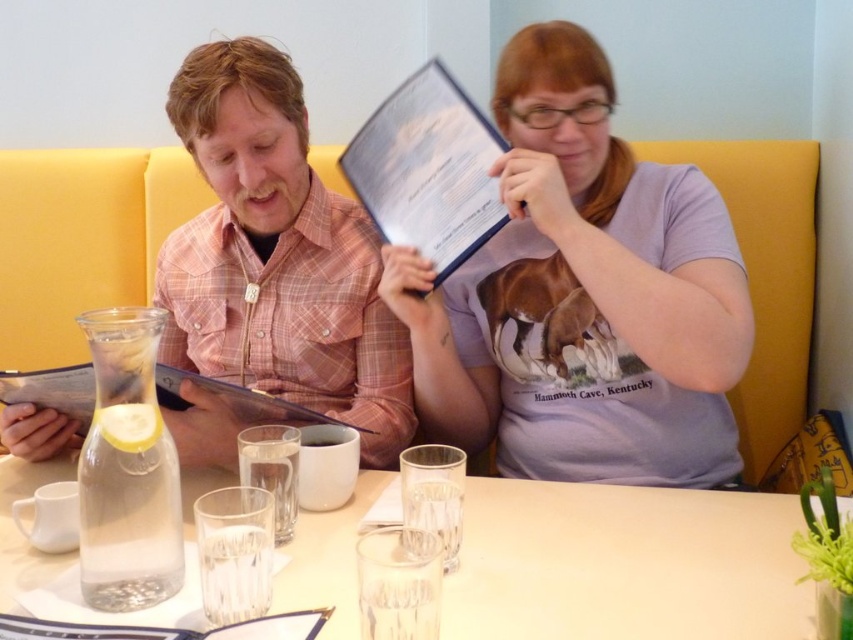
Does clear glass water at center have a greater width compared to white paper menu at upper center?

Indeed, clear glass water at center has a greater width compared to white paper menu at upper center.

Does clear glass water at center come in front of white paper menu at upper center?

That is True.

Identify the location of clear glass water at center. Image resolution: width=853 pixels, height=640 pixels. (625, 563).

Which is above, purple cotton shirt at upper right or white paper menu at upper center?

Positioned higher is white paper menu at upper center.

Is purple cotton shirt at upper right in front of white paper menu at upper center?

Yes, purple cotton shirt at upper right is in front of white paper menu at upper center.

Where is `purple cotton shirt at upper right`? purple cotton shirt at upper right is located at coordinates (583, 296).

Where is `purple cotton shirt at upper right`? This screenshot has height=640, width=853. purple cotton shirt at upper right is located at coordinates (583, 296).

Is the position of clear glass water at center less distant than that of matte plastic clipboard at left?

That is True.

Does clear glass water at center have a lesser height compared to matte plastic clipboard at left?

Yes, clear glass water at center is shorter than matte plastic clipboard at left.

Between point (642, 561) and point (51, 390), which one is positioned behind?

The point (51, 390) is behind.

At what (x,y) coordinates should I click in order to perform the action: click on clear glass water at center. Please return your answer as a coordinate pair (x, y). This screenshot has width=853, height=640. Looking at the image, I should click on (625, 563).